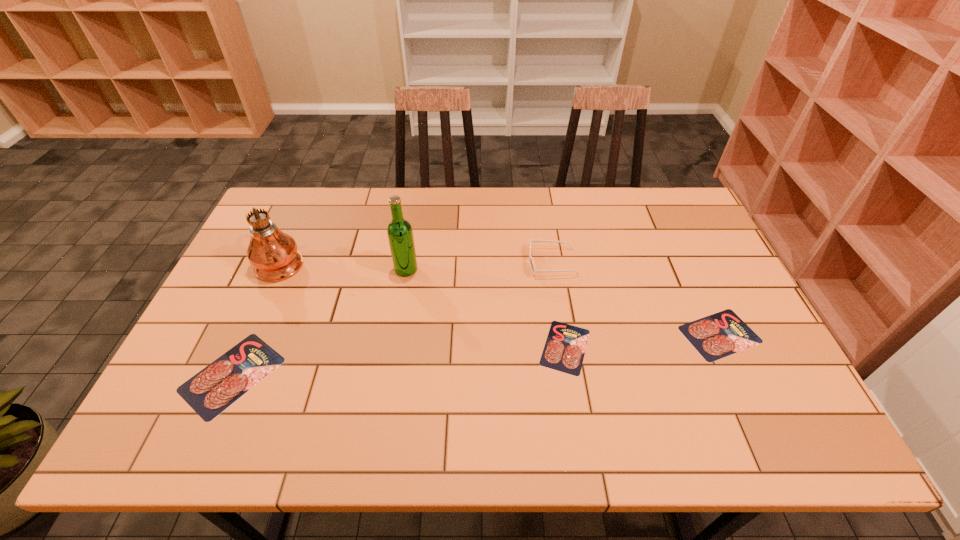
To ensure equal spacing by inserting another salami among them, please point out a vacant spot for this new salami. Please provide its 2D coordinates. Your answer should be formatted as a tuple, i.e. [(x, y)], where the tuple contains the x and y coordinates of a point satisfying the conditions above.

[(403, 361)]